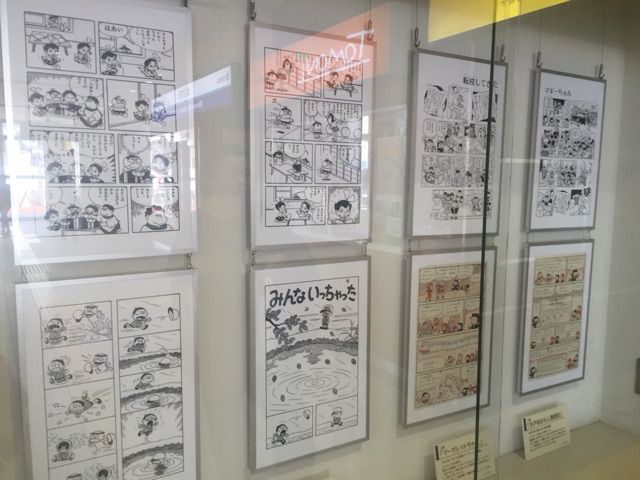
Locate an element on the screen. The width and height of the screenshot is (640, 480). framed comics is located at coordinates (98, 137), (132, 353), (310, 339), (317, 166), (443, 167), (465, 314), (560, 290), (562, 181).